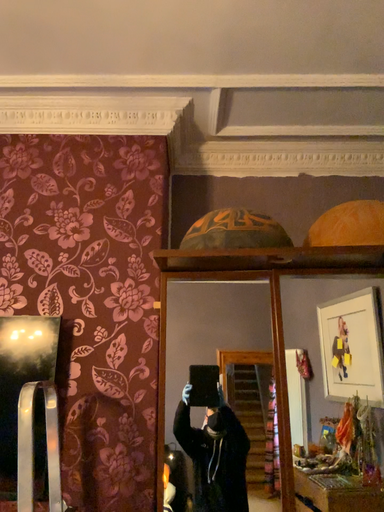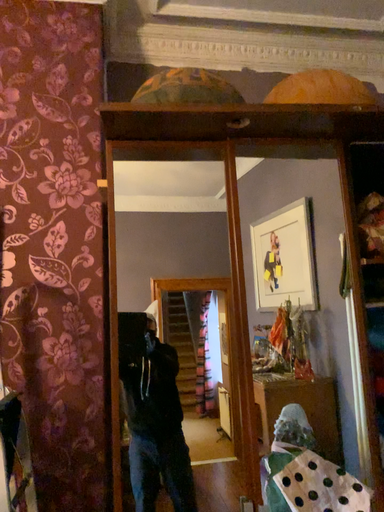
Question: Which way did the camera rotate in the video?

Choices:
 (A) rotated downward
 (B) rotated upward

Answer: (A)